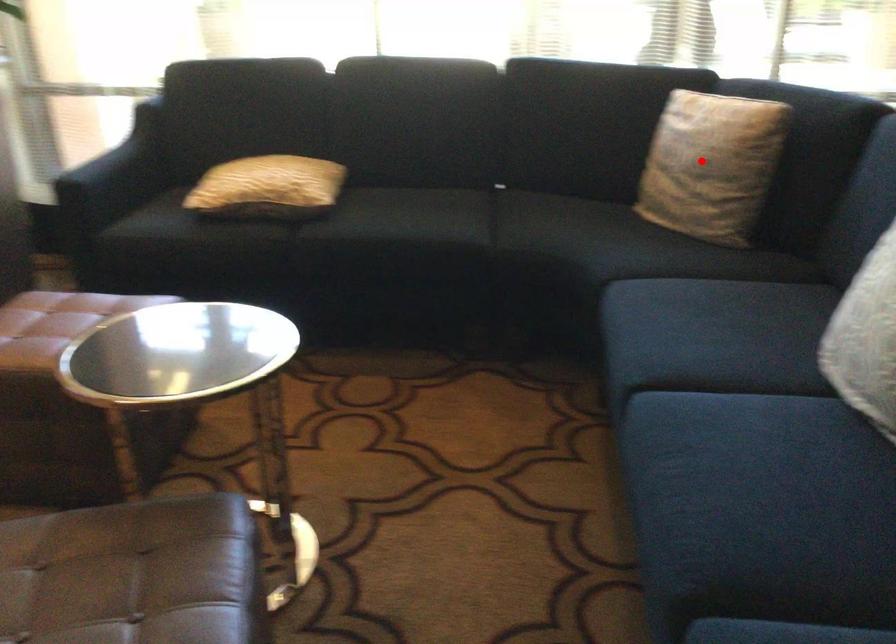
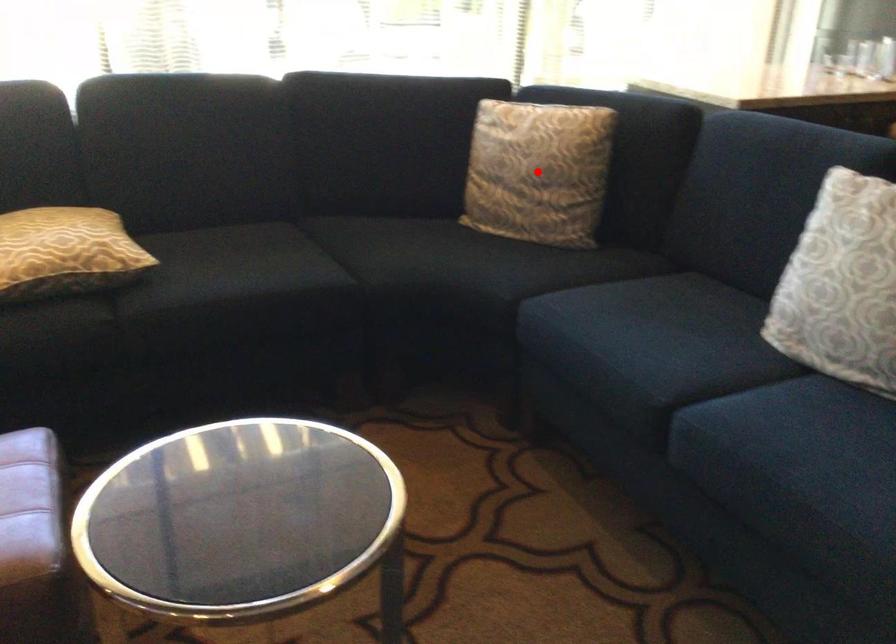
I am providing you with two images of the same scene from different viewpoints. A red point is marked on the first image and another point is marked on the second image. Are the points marked in image1 and image2 representing the same 3D position?

Yes